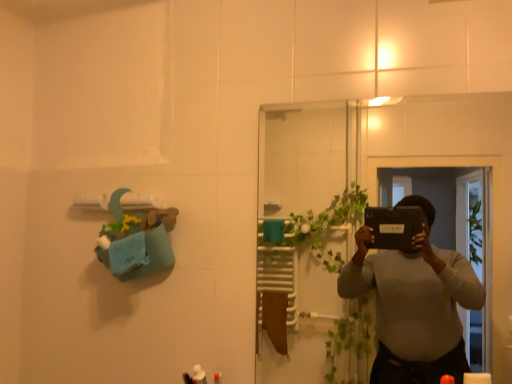
Locate an element on the screen. The width and height of the screenshot is (512, 384). clear glass mirror at upper right is located at coordinates click(451, 164).

What do you see at coordinates (451, 164) in the screenshot? This screenshot has height=384, width=512. I see `clear glass mirror at upper right` at bounding box center [451, 164].

Image resolution: width=512 pixels, height=384 pixels. What are the coordinates of `clear glass mirror at upper right` in the screenshot? It's located at (451, 164).